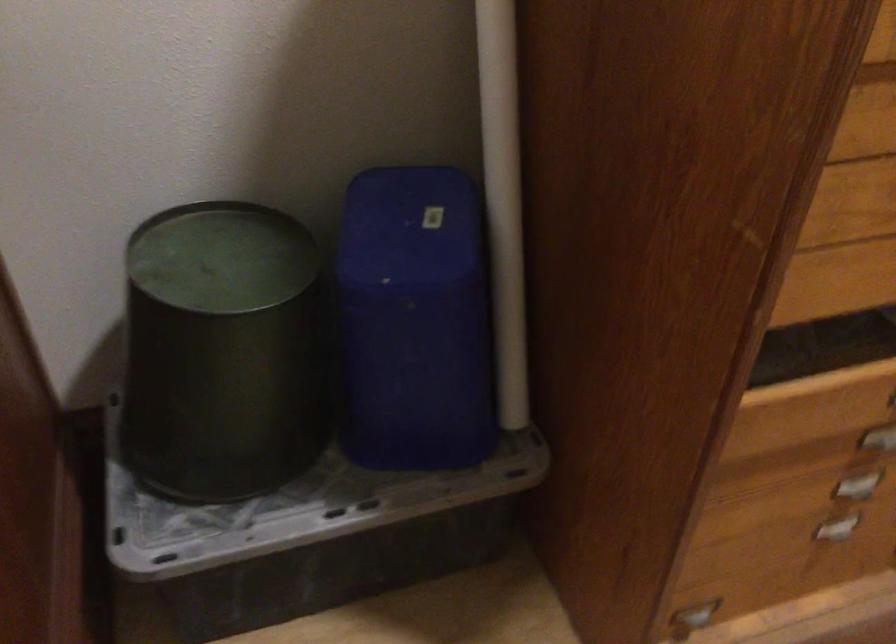
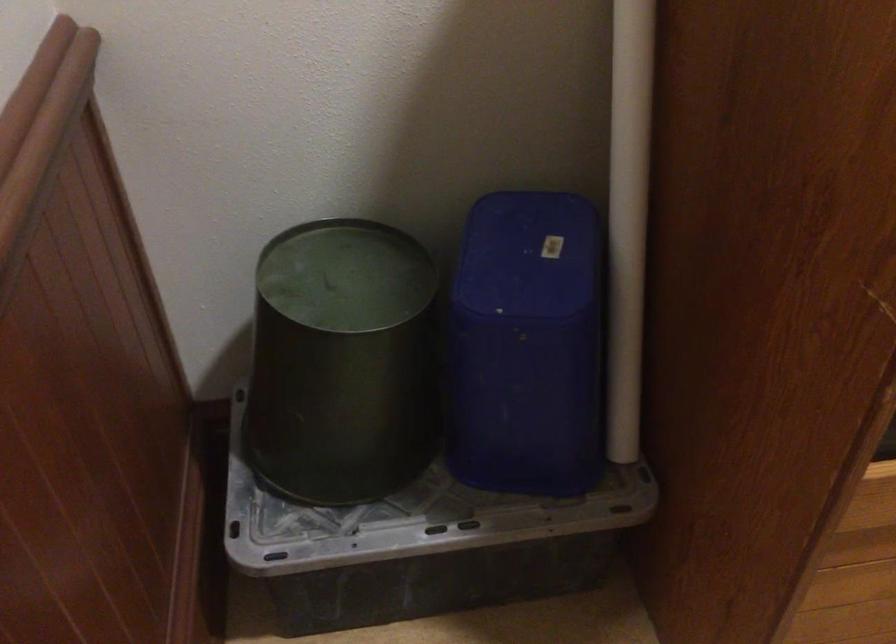
Find the pixel in the second image that matches point (225, 344) in the first image.

(342, 362)